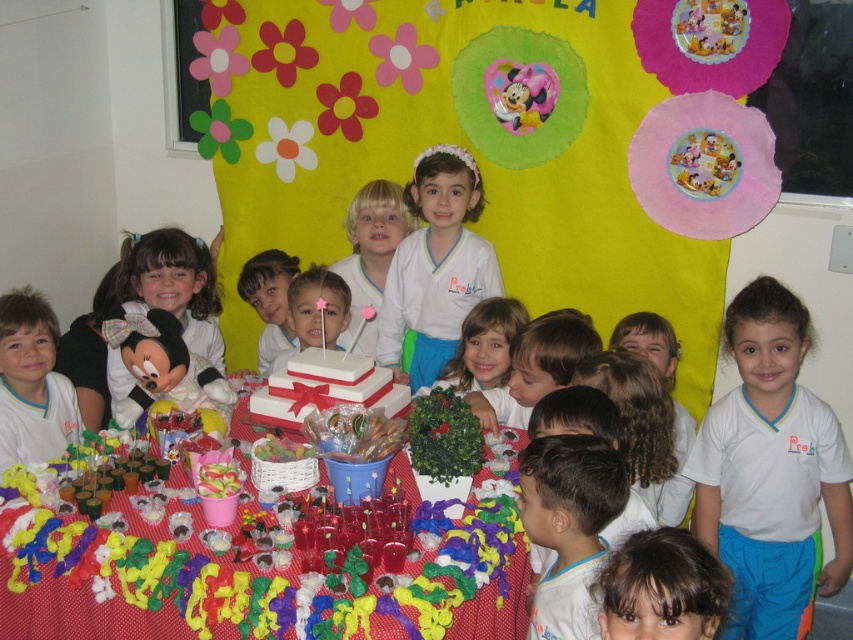
Question: Which of the following is the closest to the observer?

Choices:
 (A) (531, 452)
 (B) (167, 586)

Answer: (A)

Question: Which object appears farthest from the camera in this image?

Choices:
 (A) white cotton shirt at lower right
 (B) white matte shirt at center
 (C) brown hair at lower center
 (D) matte white cake at center

Answer: (D)

Question: Is brown hair at lower center below white plush minnie mouse at left?

Choices:
 (A) no
 (B) yes

Answer: (B)

Question: Can you confirm if yellow felt bulletin board at upper center is positioned above white glossy cake at center?

Choices:
 (A) yes
 (B) no

Answer: (A)

Question: Which object is closer to the camera taking this photo?

Choices:
 (A) white cotton shirt at lower right
 (B) brown hair at lower center
 (C) matte white cake at center
 (D) brown hair at left

Answer: (B)

Question: Is white cotton shirt at lower right to the left of white plush minnie mouse at left from the viewer's perspective?

Choices:
 (A) yes
 (B) no

Answer: (B)